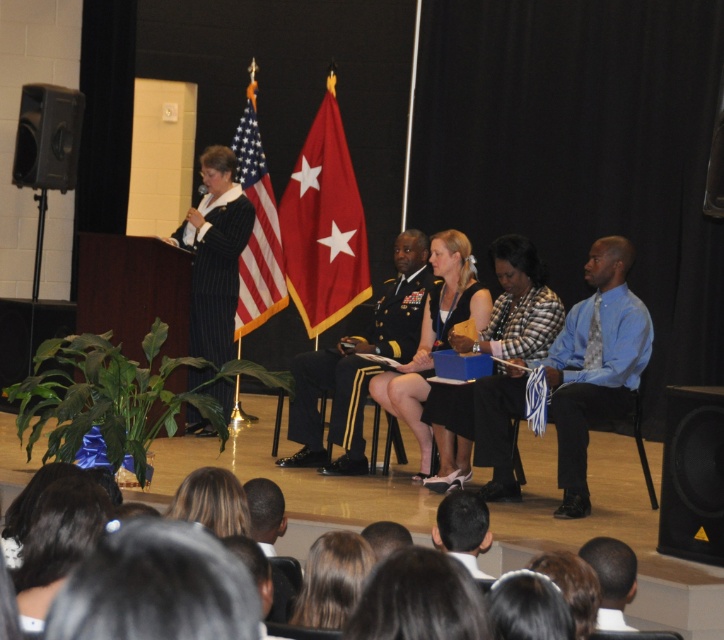
You are an attendee at this event and want to take a photo of the speaker without anyone blocking your view. Which person, the shiny black uniform at center or the black hair at lower center, is closer to the front of the stage?

The shiny black uniform at center is closer to the front of the stage because the black hair at lower center is behind it.

You are an event planner ensuring that the stage setup is safe for performers. The black matte speaker at lower right and the matte black dress at center are both on the stage. Which object is shorter?

The black matte speaker at lower right is not as tall as the matte black dress at center, so the black matte speaker at lower right is shorter.

You are standing at the center of the stage and want to move to the point marked as point (248, 269). Which direction should you go relative to point (264, 515)?

You should move behind point (264, 515) to reach point (248, 269) because point (248, 269) is behind point (264, 515).